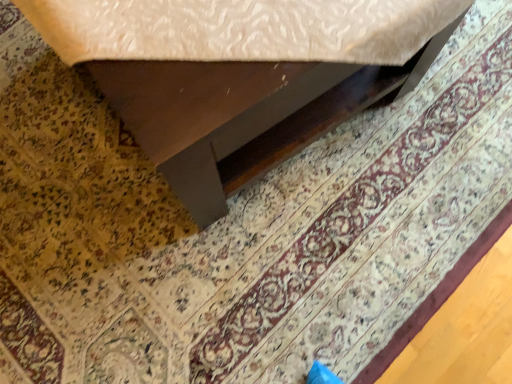
Describe the element at coordinates (239, 76) in the screenshot. I see `matte brown table at lower left` at that location.

Find the location of `matte brown table at lower left`. matte brown table at lower left is located at coordinates (239, 76).

Identify the location of matte brown table at lower left. The width and height of the screenshot is (512, 384). (239, 76).